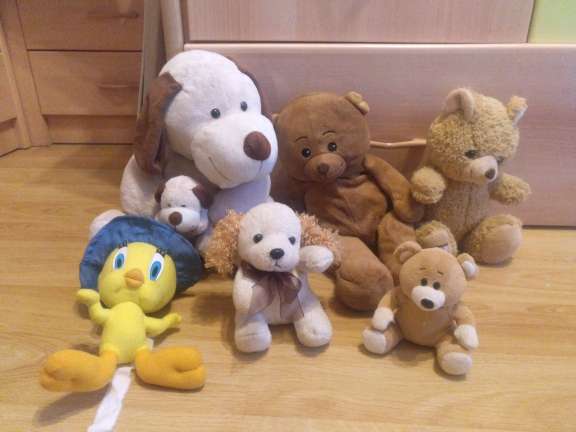
Image resolution: width=576 pixels, height=432 pixels. I want to click on stuffed animals, so click(x=140, y=289), click(x=184, y=205), click(x=216, y=128), click(x=275, y=258), click(x=333, y=144), click(x=438, y=285), click(x=473, y=180).